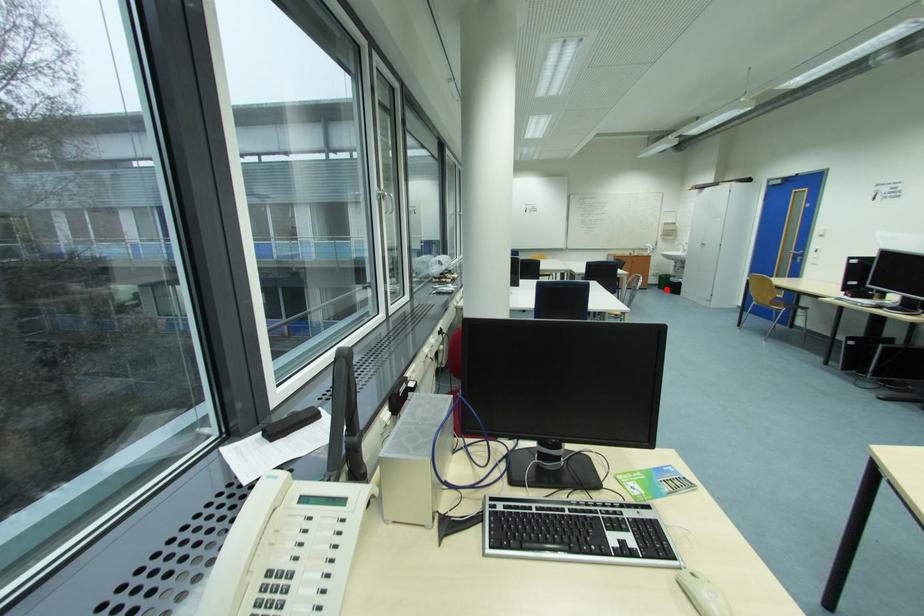
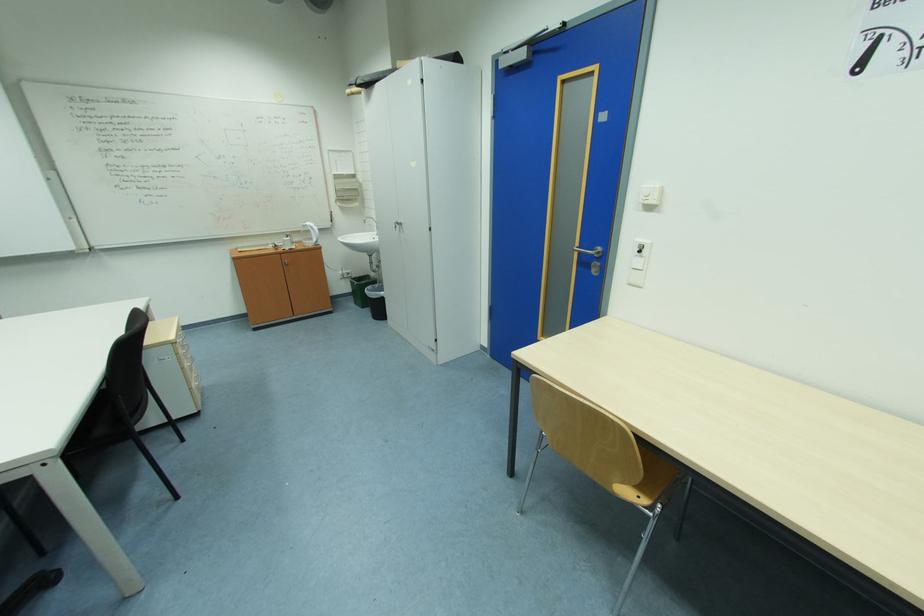
Question: I am providing you with two images of the same scene from different viewpoints. Image1 has a red point marked. In image2, the corresponding 3D location appears at what relative position? Reply with the corresponding letter.

Choices:
 (A) Closer
 (B) Farther

Answer: (A)